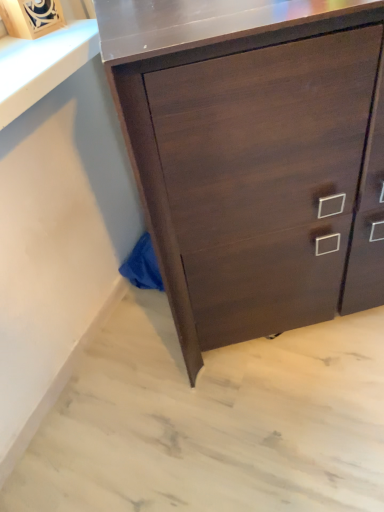
What is the approximate height of dark wood cabinet at center?

dark wood cabinet at center is 3.35 feet in height.

Image resolution: width=384 pixels, height=512 pixels. Describe the element at coordinates (254, 157) in the screenshot. I see `dark wood cabinet at center` at that location.

I want to click on dark wood cabinet at center, so click(254, 157).

This screenshot has height=512, width=384. I want to click on dark wood cabinet at center, so click(254, 157).